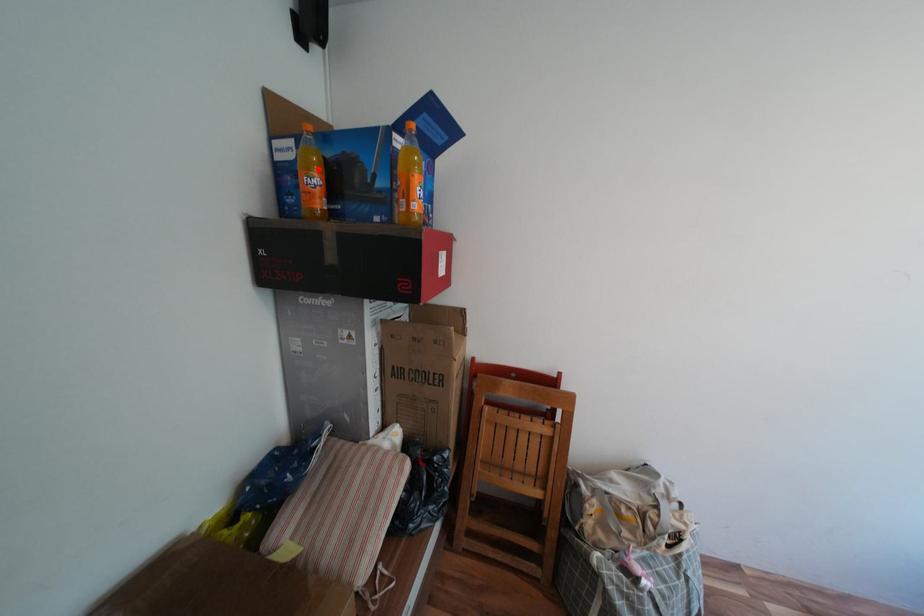
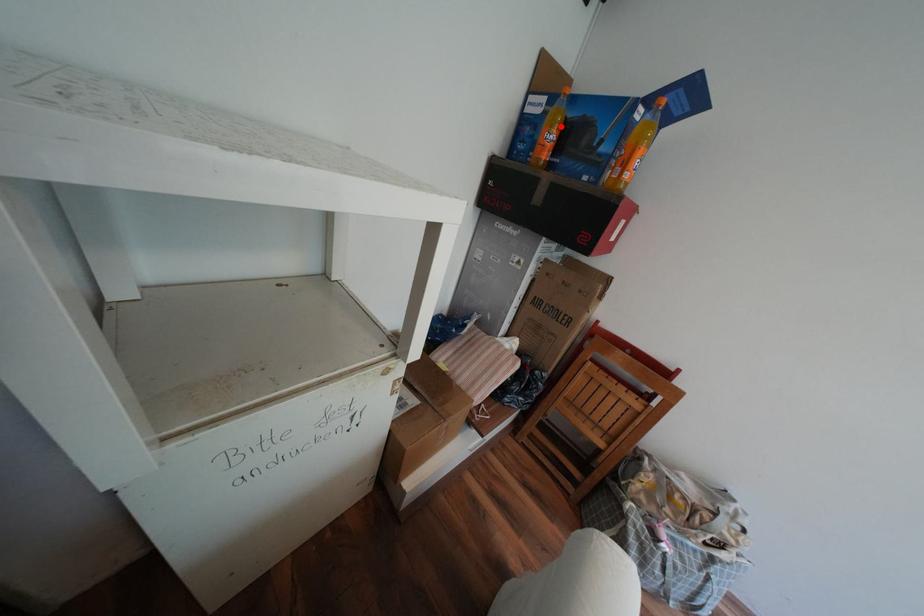
I am providing you with two images of the same scene from different viewpoints. A red point is marked on the first image and another point is marked on the second image. Does the point marked in image1 correspond to the same location as the one in image2?

Yes